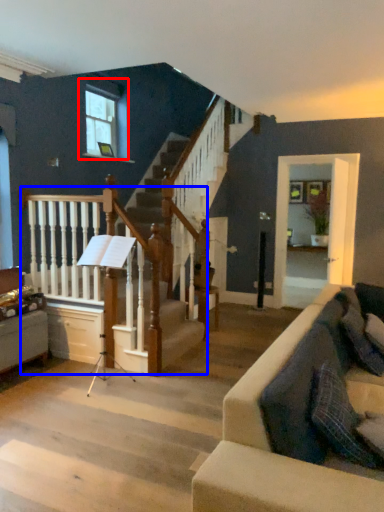
Question: Which of the following is the farthest to the observer, window (highlighted by a red box) or rail (highlighted by a blue box)?

Choices:
 (A) window
 (B) rail

Answer: (A)